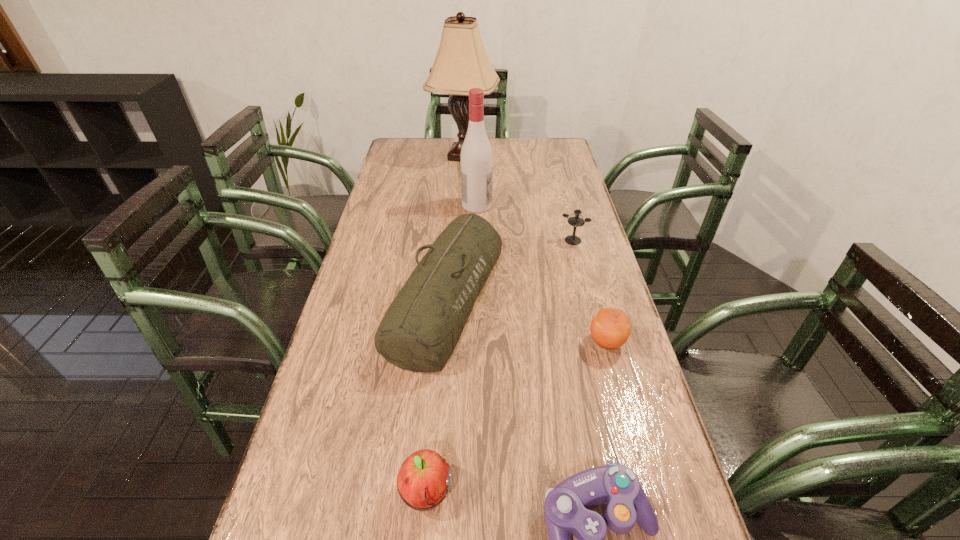
The width and height of the screenshot is (960, 540). Find the location of `blank space located on the back of the duffel bag`. blank space located on the back of the duffel bag is located at coordinates (454, 206).

Where is `vacant position located 0.150m on the front of the candle holder`? vacant position located 0.150m on the front of the candle holder is located at coordinates (583, 277).

Image resolution: width=960 pixels, height=540 pixels. Identify the location of vacant space positioned 0.180m on the left of the apple. (304, 493).

Locate an element on the screen. The width and height of the screenshot is (960, 540). vacant area situated on the left of the orange is located at coordinates (439, 342).

The height and width of the screenshot is (540, 960). Identify the location of object positioned at the far edge. (461, 63).

Identify the location of object that is at the left edge. Image resolution: width=960 pixels, height=540 pixels. (421, 328).

Where is `candle holder located in the right edge section of the desktop`? candle holder located in the right edge section of the desktop is located at coordinates (576, 221).

Where is `orange at the right edge`? This screenshot has height=540, width=960. orange at the right edge is located at coordinates (x=610, y=328).

Locate an element on the screen. The width and height of the screenshot is (960, 540). free location at the far edge is located at coordinates (436, 162).

Find the location of a particular element. This screenshot has height=540, width=960. vacant space at the left edge is located at coordinates (374, 236).